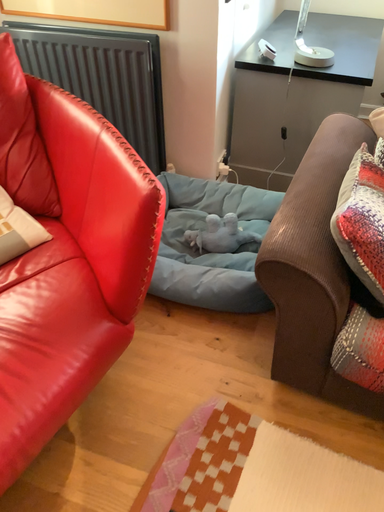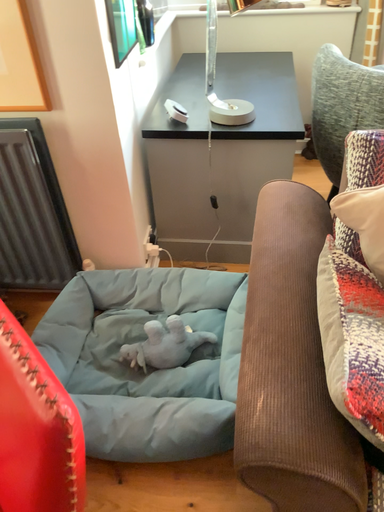
Question: How did the camera likely rotate when shooting the video?

Choices:
 (A) rotated right
 (B) rotated left

Answer: (A)